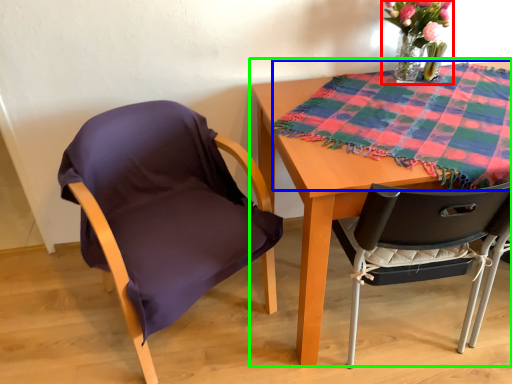
Question: Estimate the real-world distances between objects in this image. Which object is closer to floral arrangement (highlighted by a red box), blanket (highlighted by a blue box) or table (highlighted by a green box)?

Choices:
 (A) blanket
 (B) table

Answer: (A)